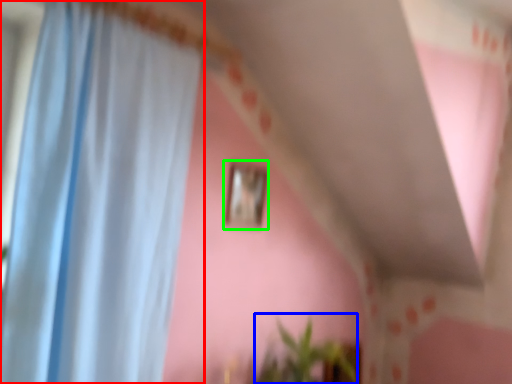
Question: Which object is positioned closest to curtain (highlighted by a red box)? Select from plant (highlighted by a blue box) and picture frame (highlighted by a green box).

Choices:
 (A) plant
 (B) picture frame

Answer: (B)